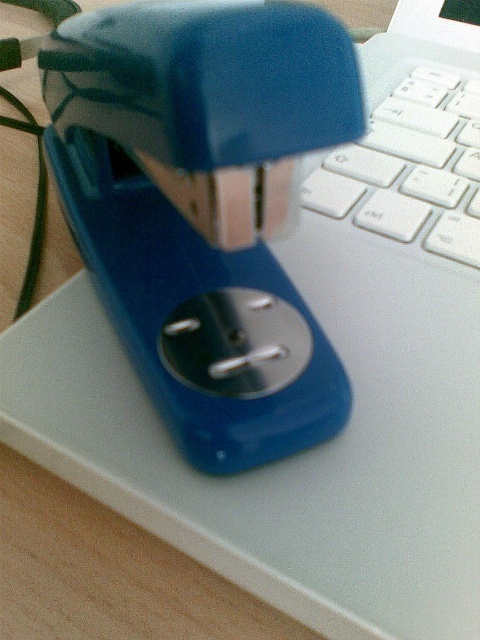
What do you see at coordinates (192, 221) in the screenshot?
I see `blue plastic stapler at center` at bounding box center [192, 221].

Does blue plastic stapler at center have a greater width compared to white plastic keyboard at upper right?

Indeed, blue plastic stapler at center has a greater width compared to white plastic keyboard at upper right.

Identify the location of blue plastic stapler at center. The width and height of the screenshot is (480, 640). (192, 221).

Find the location of a particular element. The height and width of the screenshot is (640, 480). blue plastic stapler at center is located at coordinates (192, 221).